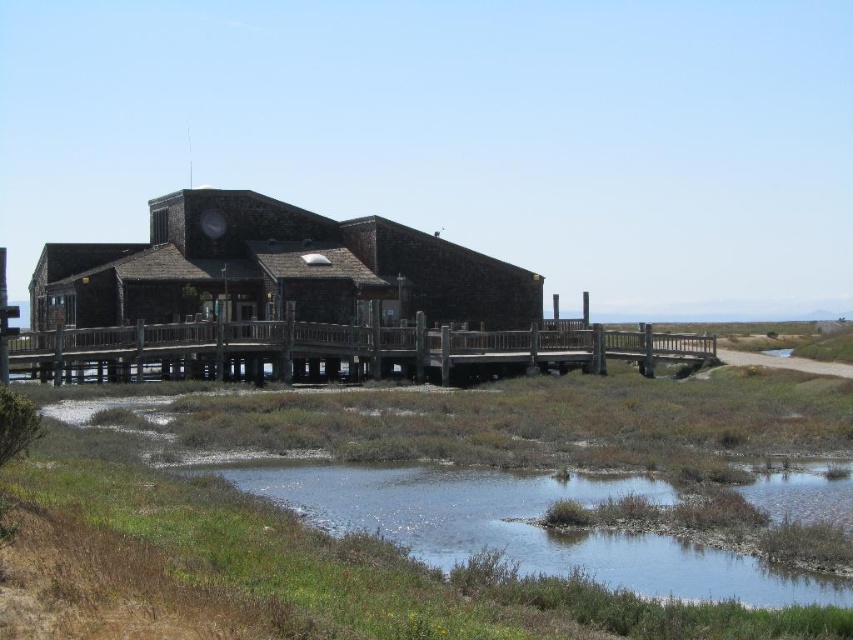
Question: Does brown wood hut at center have a smaller size compared to clear water at lower center?

Choices:
 (A) no
 (B) yes

Answer: (A)

Question: Which object is closer to the camera taking this photo?

Choices:
 (A) brown wood hut at center
 (B) clear water at lower center

Answer: (B)

Question: Which of the following is the closest to the observer?

Choices:
 (A) clear water at lower center
 (B) brown wood hut at center

Answer: (A)

Question: Is brown wood hut at center thinner than clear water at lower center?

Choices:
 (A) yes
 (B) no

Answer: (B)

Question: Is brown wood hut at center below clear water at lower center?

Choices:
 (A) yes
 (B) no

Answer: (B)